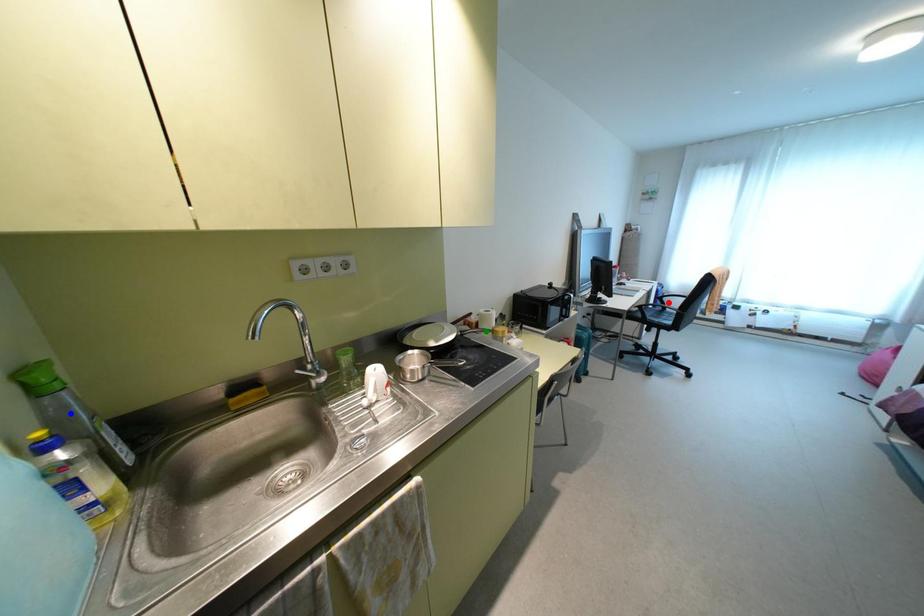
Order these from farthest to nearest:
green point
red point
blue point

red point < green point < blue point